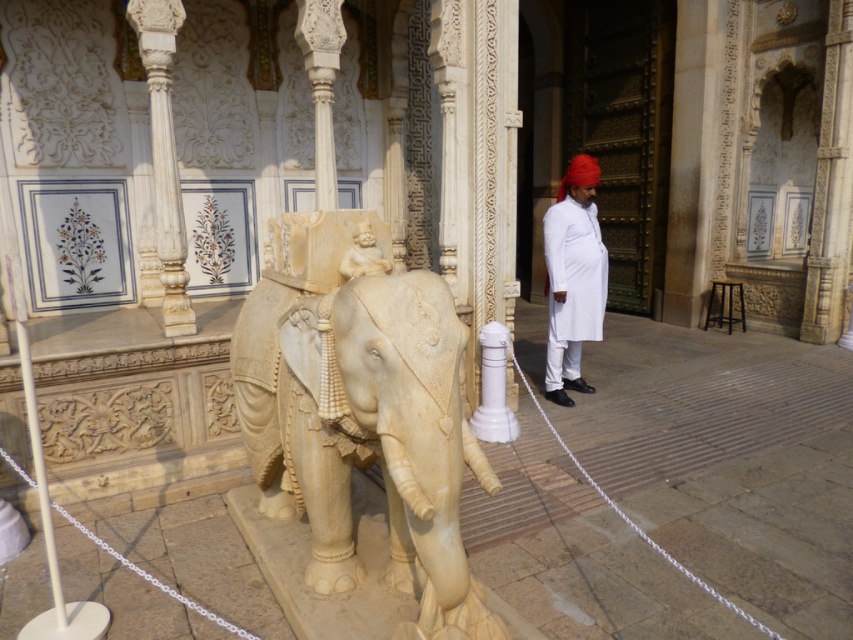
Which of these two, white marble elephant at center or white cotton turban at right, stands taller?

white cotton turban at right

Can you confirm if white marble elephant at center is bigger than white cotton turban at right?

Yes, white marble elephant at center is bigger than white cotton turban at right.

In order to click on white marble elephant at center in this screenshot , I will do `click(376, 442)`.